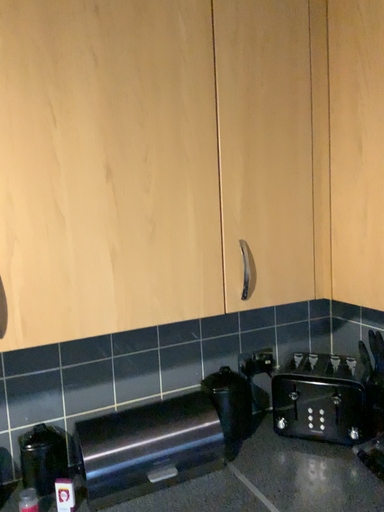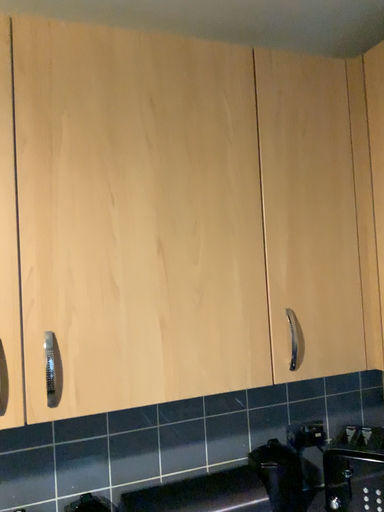
Question: How did the camera likely rotate when shooting the video?

Choices:
 (A) rotated upward
 (B) rotated downward

Answer: (A)